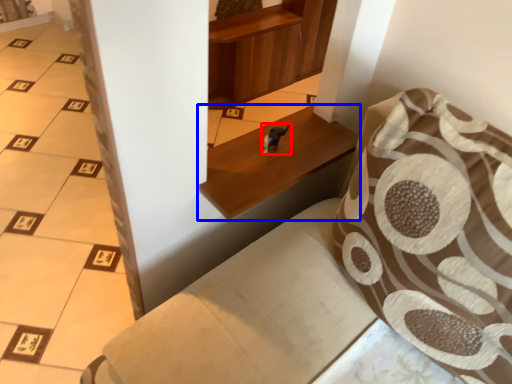
Question: Among these objects, which one is nearest to the camera, animal (highlighted by a red box) or furniture (highlighted by a blue box)?

Choices:
 (A) animal
 (B) furniture

Answer: (B)